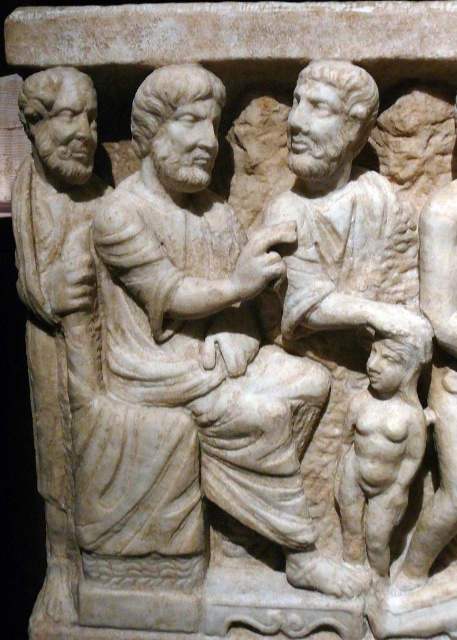
Can you confirm if white marble child at right is thinner than white marble child at lower right?

No, white marble child at right is not thinner than white marble child at lower right.

The image size is (457, 640). In order to click on white marble child at right in this screenshot , I will do `click(356, 296)`.